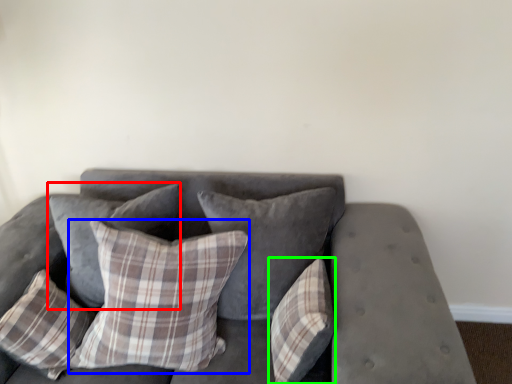
Question: Based on their relative distances, which object is nearer to pillow (highlighted by a red box)? Choose from pillow (highlighted by a blue box) and pillow (highlighted by a green box).

Choices:
 (A) pillow
 (B) pillow

Answer: (A)